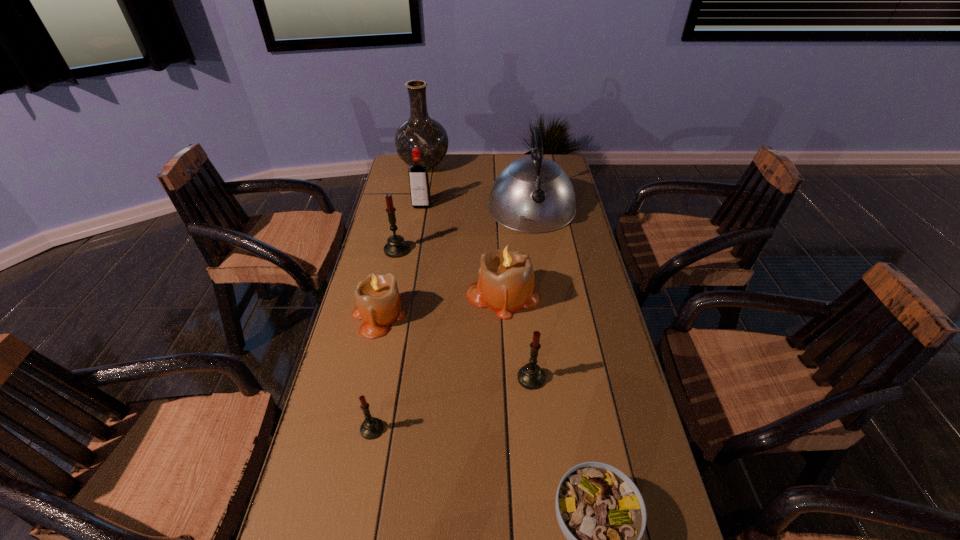
Find the location of a particular element. The width and height of the screenshot is (960, 540). free space between the left beige candle and the right beige candle is located at coordinates (441, 306).

What are the coordinates of `vacant region between the shortest candle and the farthest red candle` in the screenshot? It's located at (385, 339).

Where is `free spot between the kettle and the vase`? The height and width of the screenshot is (540, 960). free spot between the kettle and the vase is located at coordinates (478, 187).

The image size is (960, 540). Identify the location of empty space that is in between the second biggest red candle and the left beige candle. (455, 347).

Image resolution: width=960 pixels, height=540 pixels. Find the location of `object that is the fifth closest to the kettle`. object that is the fifth closest to the kettle is located at coordinates (378, 301).

Identify which object is the fourth nearest to the second tallest object. Please provide its 2D coordinates. Your answer should be formatted as a tuple, i.e. [(x, y)], where the tuple contains the x and y coordinates of a point satisfying the conditions above.

[(396, 247)]

At what (x,y) coordinates should I click in order to perform the action: click on candle identified as the closest to the second biggest red candle. Please return your answer as a coordinate pair (x, y). Looking at the image, I should click on (505, 284).

Locate which candle is the fourth closest to the biggest red candle. Please provide its 2D coordinates. Your answer should be formatted as a tuple, i.e. [(x, y)], where the tuple contains the x and y coordinates of a point satisfying the conditions above.

[(371, 428)]

Locate an element on the screen. The width and height of the screenshot is (960, 540). red candle that is the closest to the smallest red candle is located at coordinates (531, 376).

The height and width of the screenshot is (540, 960). In order to click on the closest red candle to the second shortest object in this screenshot , I will do `click(531, 376)`.